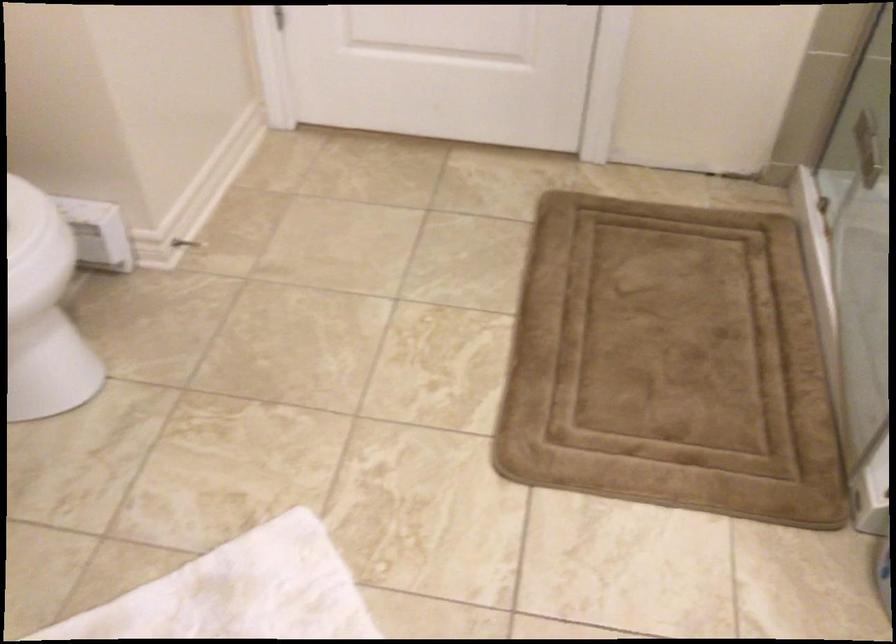
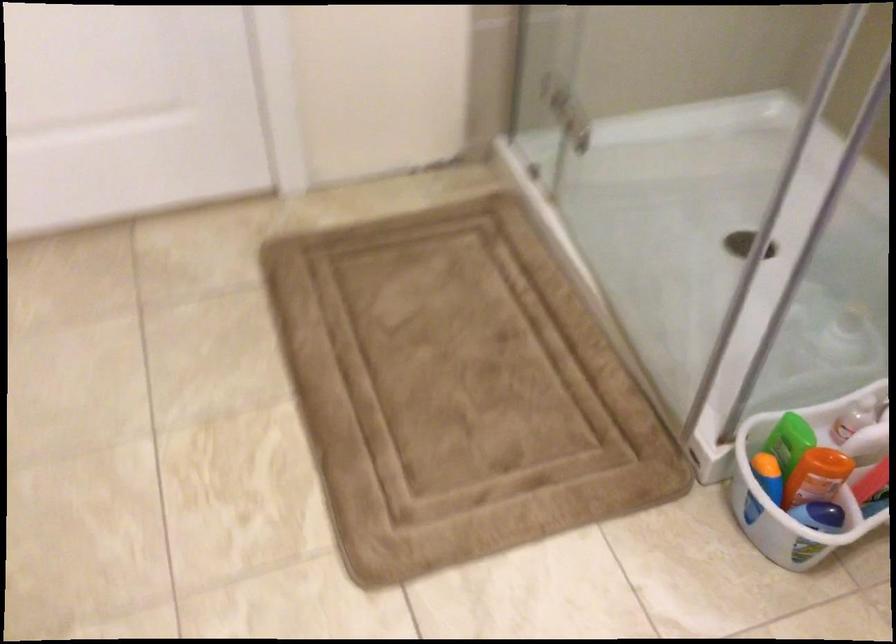
Question: How did the camera likely rotate?

Choices:
 (A) Left
 (B) Right
 (C) Up
 (D) Down

Answer: (B)